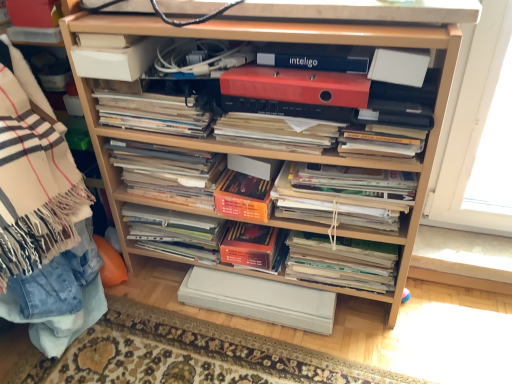
In order to click on free space in front of matte orange paperback book at center, which appears as the seventh paperback book when viewed from the top in this screenshot , I will do `click(265, 358)`.